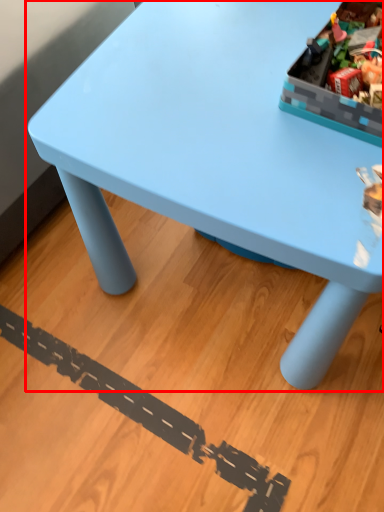
Question: In this image, where is table (annotated by the red box) located relative to storage box?

Choices:
 (A) left
 (B) right

Answer: (A)